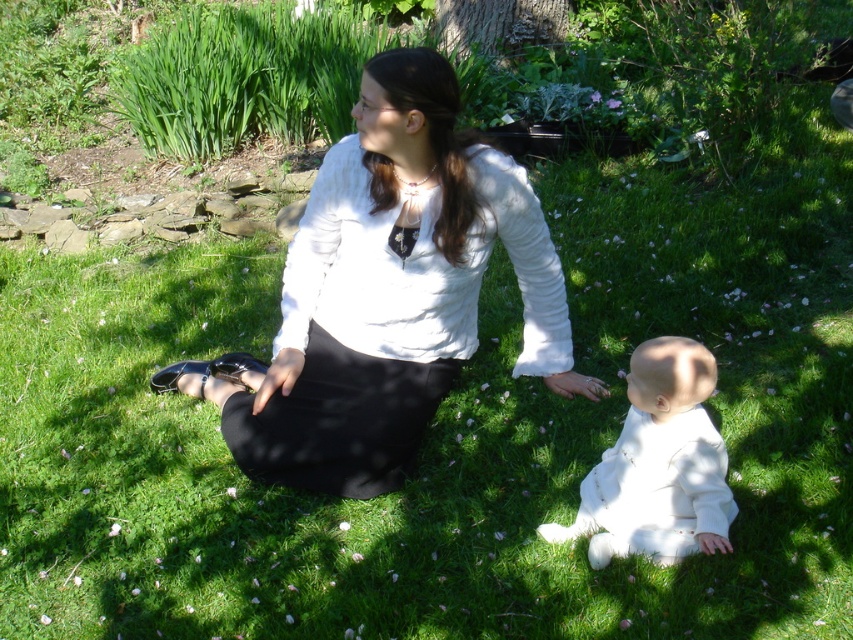
Question: Among these points, which one is farthest from the camera?

Choices:
 (A) click(233, 451)
 (B) click(659, 381)

Answer: (A)

Question: Is white matte blouse at center in front of white soft fabric baby at lower right?

Choices:
 (A) yes
 (B) no

Answer: (B)

Question: Which object appears farthest from the camera in this image?

Choices:
 (A) white matte blouse at center
 (B) white soft fabric baby at lower right

Answer: (A)

Question: Observing the image, what is the correct spatial positioning of white matte blouse at center in reference to white soft fabric baby at lower right?

Choices:
 (A) left
 (B) right

Answer: (A)

Question: Among these objects, which one is farthest from the camera?

Choices:
 (A) white matte blouse at center
 (B) white soft fabric baby at lower right

Answer: (A)

Question: Does white matte blouse at center appear on the right side of white soft fabric baby at lower right?

Choices:
 (A) no
 (B) yes

Answer: (A)